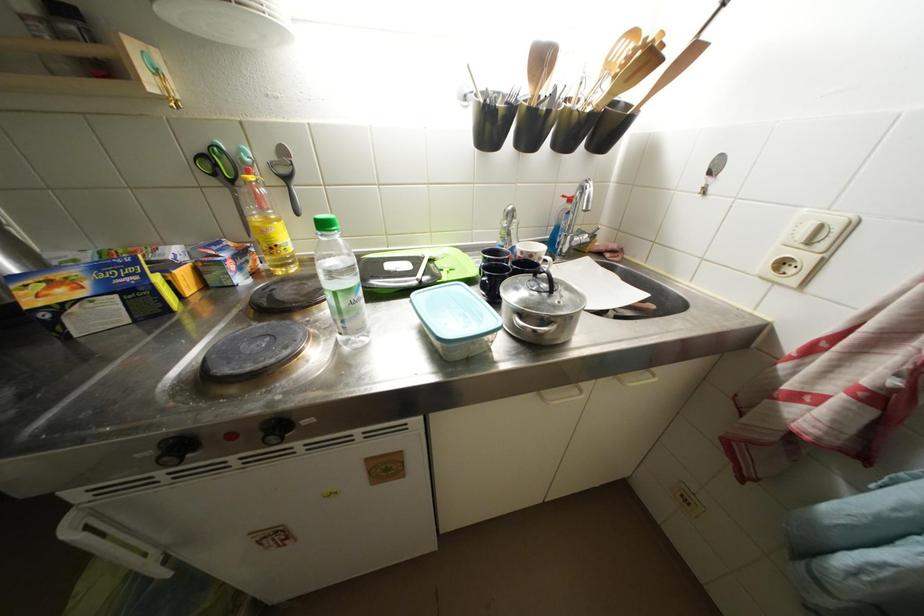
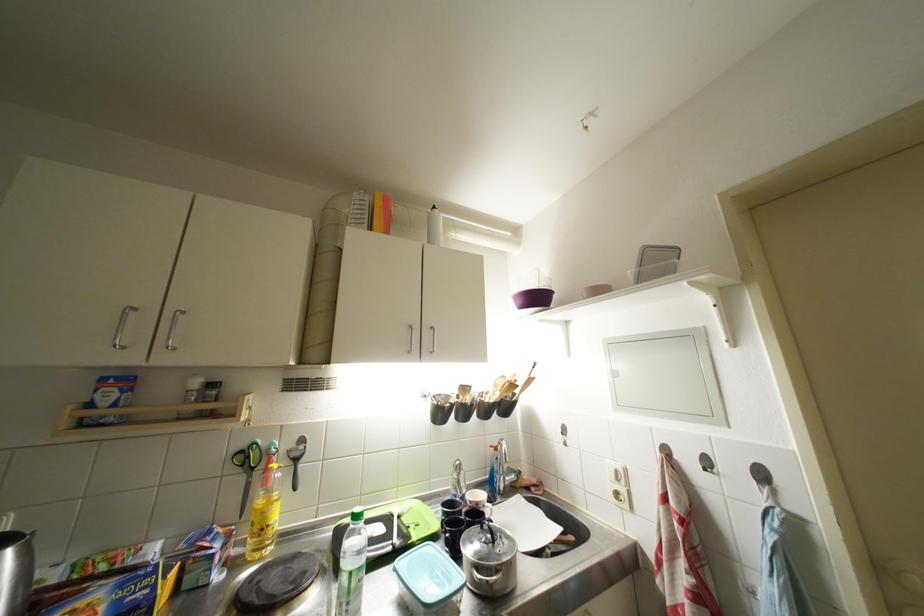
In the second image, find the point that corresponds to (x=538, y=259) in the first image.

(483, 508)